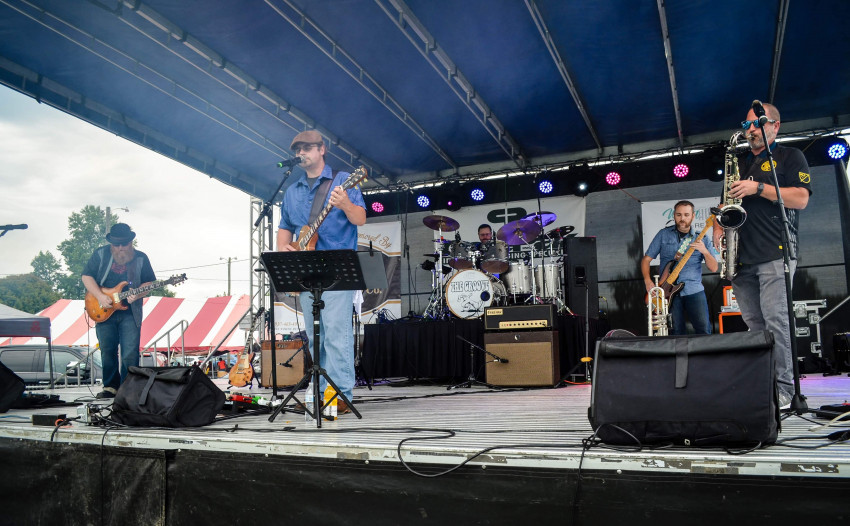
Locate an element on the screen. Image resolution: width=850 pixels, height=526 pixels. wires is located at coordinates (513, 445), (110, 424), (54, 434), (88, 331), (297, 317).